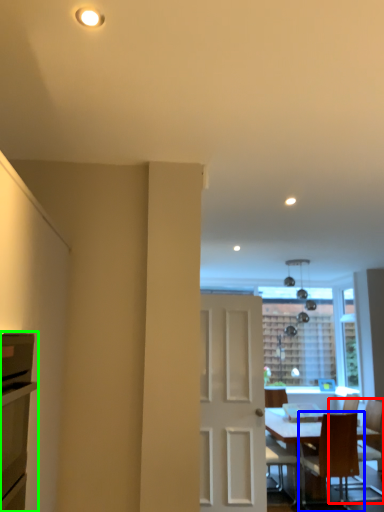
Question: Based on their relative distances, which object is nearer to chair (highlighted by a red box)? Choose from chair (highlighted by a blue box) and cabinetry (highlighted by a green box).

Choices:
 (A) chair
 (B) cabinetry

Answer: (A)